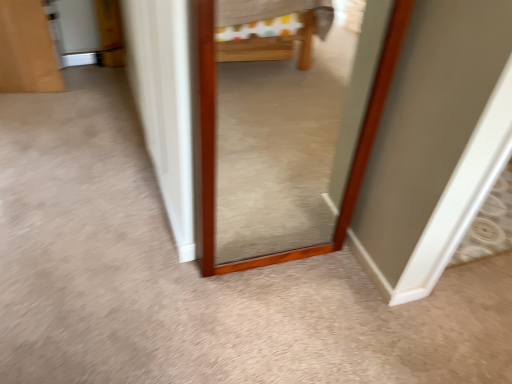
Where is `vacant area that is situated to the right of wooden frame mirror at center`? The height and width of the screenshot is (384, 512). vacant area that is situated to the right of wooden frame mirror at center is located at coordinates (316, 269).